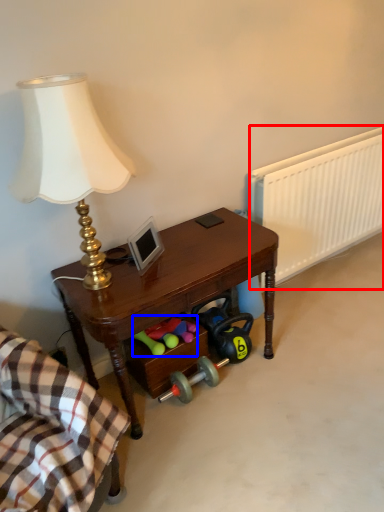
Question: Which object appears farthest to the camera in this image, radiator (highlighted by a red box) or stuff (highlighted by a blue box)?

Choices:
 (A) radiator
 (B) stuff

Answer: (A)